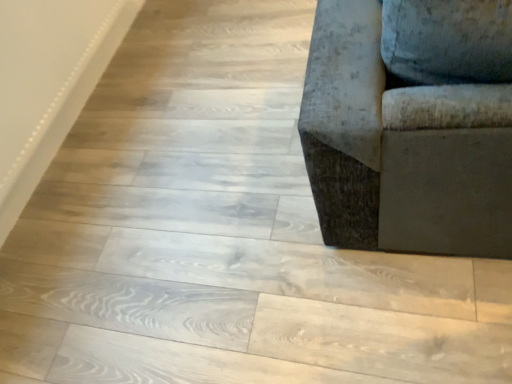
What do you see at coordinates (411, 125) in the screenshot? I see `velvet grey chair at right` at bounding box center [411, 125].

The width and height of the screenshot is (512, 384). What are the coordinates of `velvet grey chair at right` in the screenshot? It's located at (411, 125).

This screenshot has width=512, height=384. I want to click on velvet grey chair at right, so click(x=411, y=125).